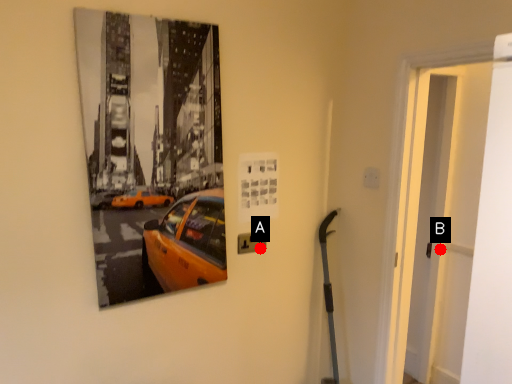
Question: Two points are circled on the image, labeled by A and B beside each circle. Which of the following is the closest to the observer?

Choices:
 (A) A is closer
 (B) B is closer

Answer: (A)